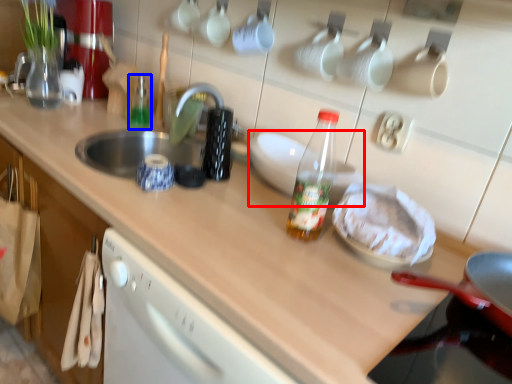
Question: Which object is closer to the camera taking this photo, appliance (highlighted by a red box) or bottle (highlighted by a blue box)?

Choices:
 (A) appliance
 (B) bottle

Answer: (A)